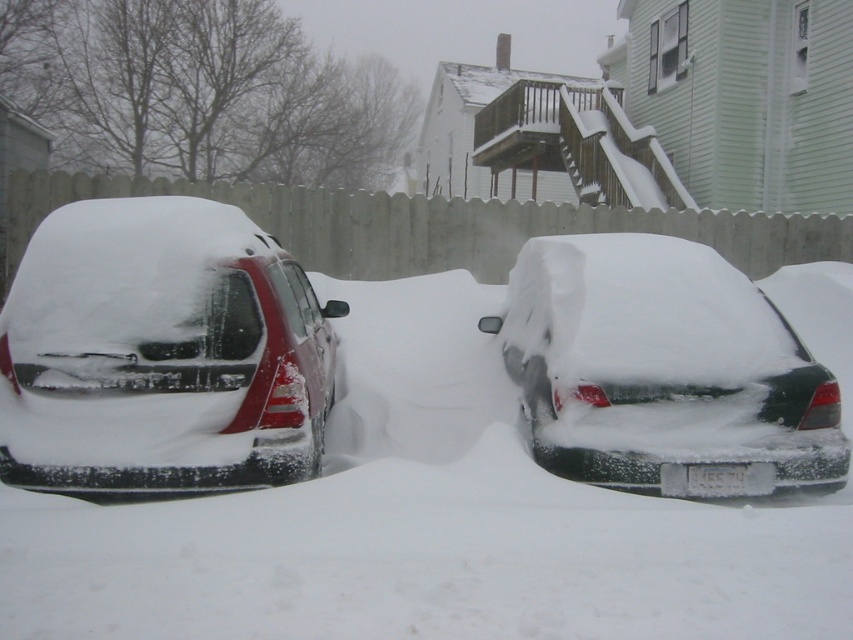
You are standing at the entrance of the driveway and want to reach the white matte car at center. Which direction should you move relative to your current position?

The white matte car at center is located at point coordinates, so you should move towards the center of the driveway to reach it.

You are trying to park your car in this snowy scene. There is a white matte car at center and a sleek matte red car at left. Which parking spot between them has more space for your vehicle?

The parking spot between the white matte car at center and the sleek matte red car at left has more space because the white matte car at center is narrower than the sleek matte red car at left, creating a wider gap.